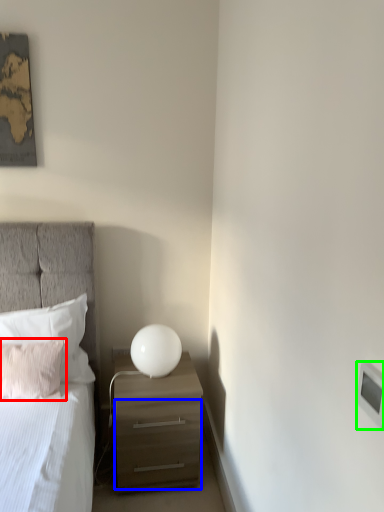
Question: Considering the real-world distances, which object is closest to pillow (highlighted by a red box)? drawer (highlighted by a blue box) or light switch (highlighted by a green box).

Choices:
 (A) drawer
 (B) light switch

Answer: (A)